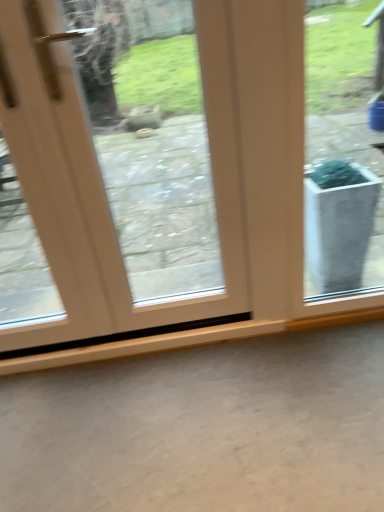
Question: From the image's perspective, is white glossy door at center above or below gray matte concrete at lower center?

Choices:
 (A) above
 (B) below

Answer: (A)

Question: Is white glossy door at center inside or outside of gray matte concrete at lower center?

Choices:
 (A) inside
 (B) outside

Answer: (B)

Question: Considering the positions of white glossy door at center and gray matte concrete at lower center in the image, is white glossy door at center bigger or smaller than gray matte concrete at lower center?

Choices:
 (A) small
 (B) big

Answer: (B)

Question: From a real-world perspective, is gray matte concrete at lower center physically located above or below white glossy door at center?

Choices:
 (A) below
 (B) above

Answer: (A)

Question: Is gray matte concrete at lower center bigger or smaller than white glossy door at center?

Choices:
 (A) small
 (B) big

Answer: (A)

Question: In terms of width, does gray matte concrete at lower center look wider or thinner when compared to white glossy door at center?

Choices:
 (A) wide
 (B) thin

Answer: (A)

Question: Considering the positions of point (299, 442) and point (168, 77), is point (299, 442) closer or farther from the camera than point (168, 77)?

Choices:
 (A) farther
 (B) closer

Answer: (B)